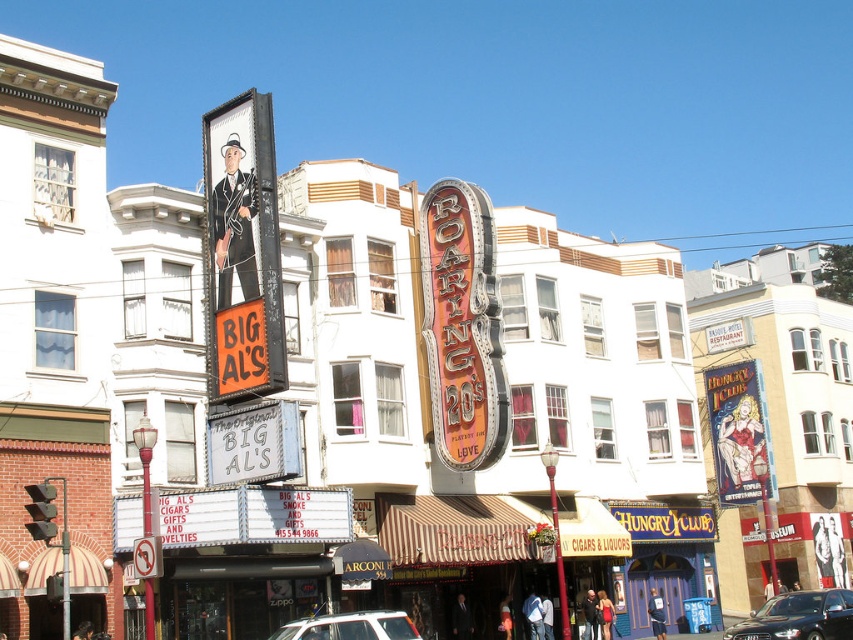
Does shiny black sedan at center have a larger size compared to white plastic car at center?

Actually, shiny black sedan at center might be smaller than white plastic car at center.

Can you confirm if shiny black sedan at center is taller than white plastic car at center?

In fact, shiny black sedan at center may be shorter than white plastic car at center.

This screenshot has width=853, height=640. Describe the element at coordinates (799, 618) in the screenshot. I see `shiny black sedan at center` at that location.

Identify the location of shiny black sedan at center. (799, 618).

Is point (421, 246) positioned before point (761, 614)?

No.

Between gold metallic sign at center and shiny black sedan at center, which one appears on the left side from the viewer's perspective?

gold metallic sign at center

This screenshot has height=640, width=853. What do you see at coordinates (462, 324) in the screenshot?
I see `gold metallic sign at center` at bounding box center [462, 324].

This screenshot has height=640, width=853. Identify the location of gold metallic sign at center. (462, 324).

From the picture: Is metallic sign at upper left to the right of shiny black sedan at center from the viewer's perspective?

No, metallic sign at upper left is not to the right of shiny black sedan at center.

Does metallic sign at upper left come in front of shiny black sedan at center?

Yes, metallic sign at upper left is in front of shiny black sedan at center.

Where is `metallic sign at upper left`? The height and width of the screenshot is (640, 853). metallic sign at upper left is located at coordinates (242, 250).